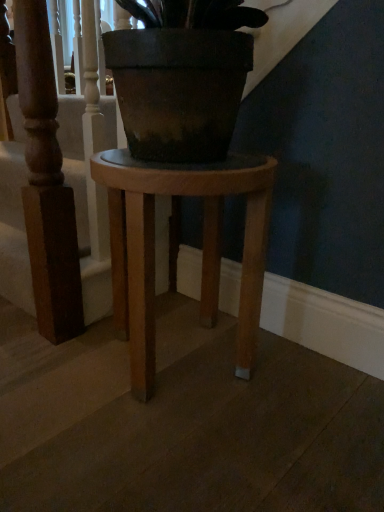
You are a GUI agent. You are given a task and a screenshot of the screen. Output one action in this format:
    pyautogui.click(x=<x>, y=<y>)
    Task: Click on the free space in front of wooden stool at center
    
    Given the screenshot: What is the action you would take?
    pyautogui.click(x=173, y=451)